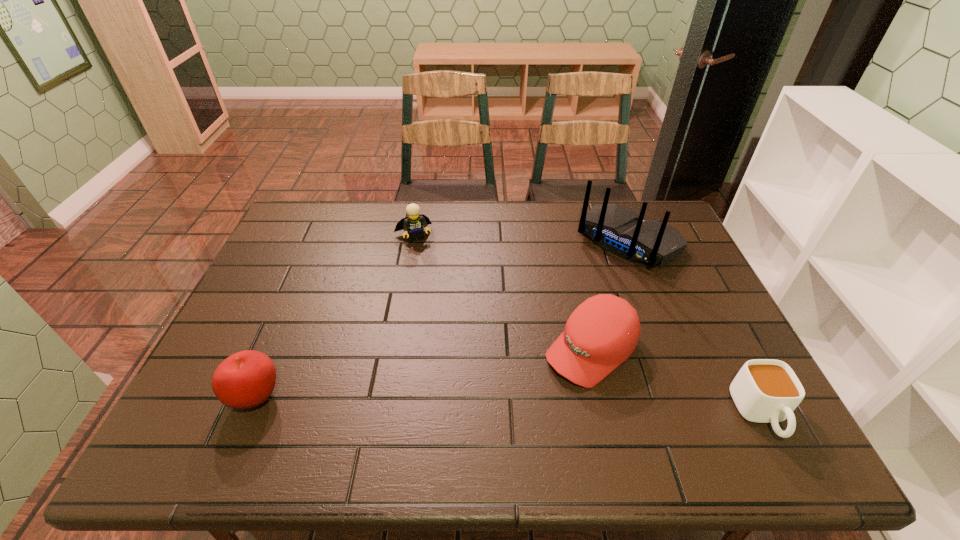
What are the coordinates of `free space on the desktop that is between the apple and the shortest object and is positioned on the front-facing side of the cap` in the screenshot? It's located at (524, 407).

In order to click on free spot on the desktop that is between the apple and the shortest object and is positioned on the front-facing side of the fourth object from right to left in this screenshot , I will do `click(482, 406)`.

You are a GUI agent. You are given a task and a screenshot of the screen. Output one action in this format:
    pyautogui.click(x=<x>, y=<y>)
    Task: Click on the vacant space on the desktop that is between the leftmost object and the cup and is positioned on the back of the router
    The width and height of the screenshot is (960, 540).
    Given the screenshot: What is the action you would take?
    pyautogui.click(x=461, y=404)